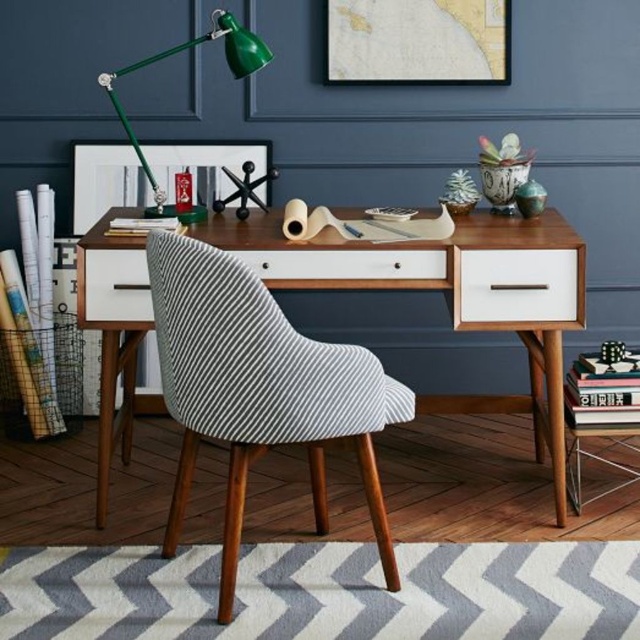
Based on the photo, you are sitting in the striped armchair and want to reach both the matte black picture frame at upper center and the white matte drawer at right. Which object will require you to stretch further to reach?

The white matte drawer at right is further away from you than the matte black picture frame at upper center, so you will need to stretch further to reach the white matte drawer at right.

You are organizing your desk and need to place a new item between the matte black picture frame at upper center and the white matte drawer at right. Based on their positions, where should you place the item?

The matte black picture frame at upper center is to the left of the white matte drawer at right, so you should place the new item between them on the desk surface, ensuring it sits horizontally between the left position of the picture frame and the right position of the drawer.

From the picture: You are a delivery person trying to place a box that is 26 inches long on the desk between the white striped fabric chair at center and the white matte drawer at right. Can the box fit horizontally between them?

The distance between the white striped fabric chair at center and the white matte drawer at right is 26.59 inches. Since the box is 26 inches long, it can fit horizontally between them as there is enough space.